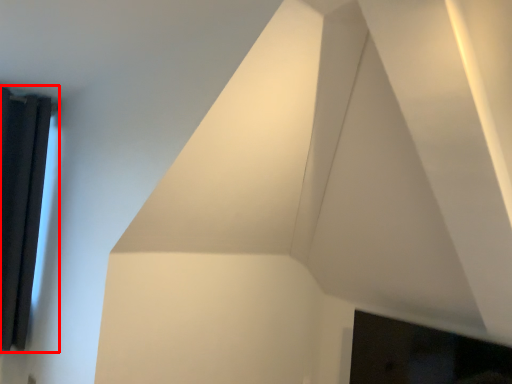
Question: From the image's perspective, considering the relative positions of window (annotated by the red box) and fireplace in the image provided, where is window (annotated by the red box) located with respect to the staircase?

Choices:
 (A) below
 (B) above

Answer: (B)